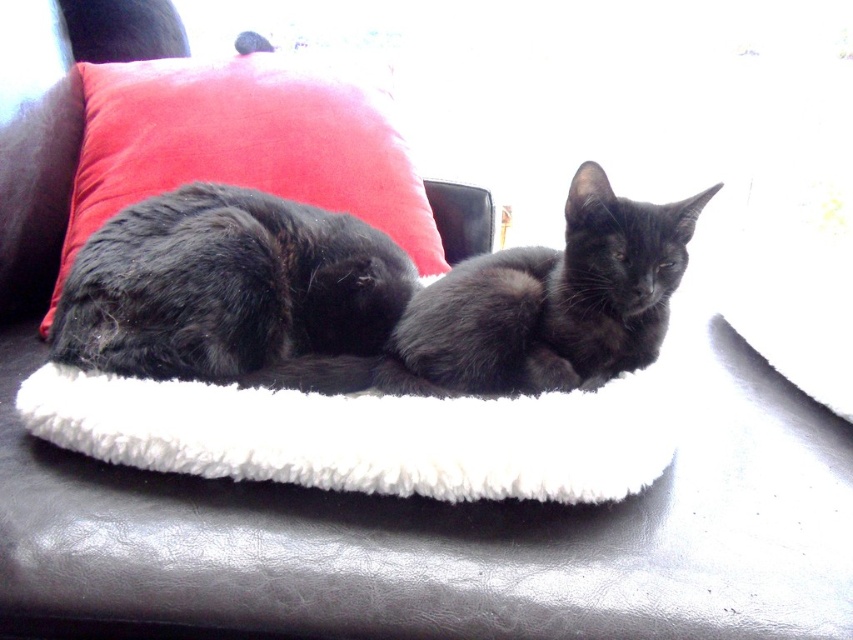
Question: Which object is closer to the camera taking this photo?

Choices:
 (A) black fur cat at center
 (B) velvet red pillow at upper left

Answer: (A)

Question: From the image, what is the correct spatial relationship of velvet red pillow at upper left in relation to black fur cat at center?

Choices:
 (A) above
 (B) below

Answer: (A)

Question: Does fluffy black cat at center come behind black fur cat at center?

Choices:
 (A) no
 (B) yes

Answer: (A)

Question: Which object is farther from the camera taking this photo?

Choices:
 (A) black fur cat at center
 (B) velvet red pillow at upper left

Answer: (B)

Question: Which of the following is the farthest from the observer?

Choices:
 (A) (618, 300)
 (B) (180, 250)

Answer: (A)

Question: From the image, what is the correct spatial relationship of fluffy black cat at center in relation to black fur cat at center?

Choices:
 (A) right
 (B) left

Answer: (B)